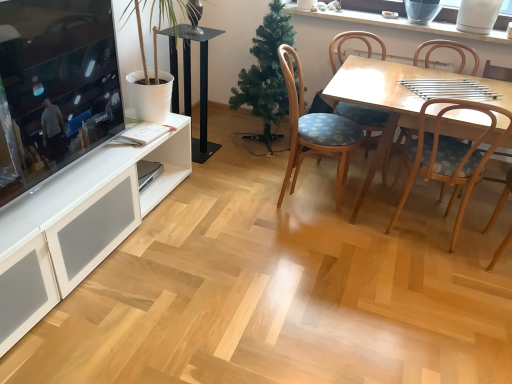
Where is `free spot to the left of blue fabric chair at center, positioned as the first chair in left-to-right order`? This screenshot has width=512, height=384. free spot to the left of blue fabric chair at center, positioned as the first chair in left-to-right order is located at coordinates (237, 190).